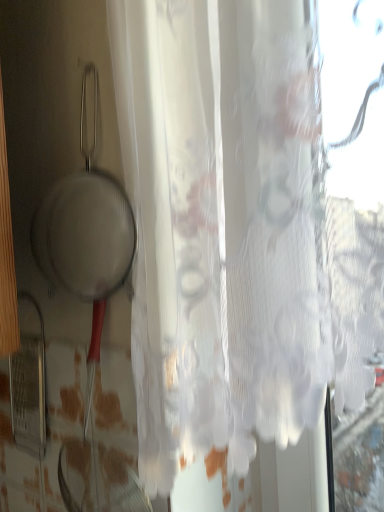
What do you see at coordinates (85, 226) in the screenshot?
I see `metallic silver frying pan at left` at bounding box center [85, 226].

Based on the photo, what is the approximate width of metallic silver frying pan at left?

The width of metallic silver frying pan at left is 3.10 inches.

The height and width of the screenshot is (512, 384). What are the coordinates of `metallic silver frying pan at left` in the screenshot? It's located at (85, 226).

Find the location of a particular element. Image resolution: width=384 pixels, height=512 pixels. metallic silver frying pan at left is located at coordinates (85, 226).